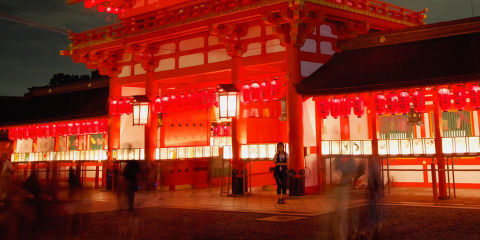
At what (x,y) coordinates should I click in order to perform the action: click on tiles. Please return your answer as a coordinate pair (x, y). The image size is (480, 240). Looking at the image, I should click on (275, 196).